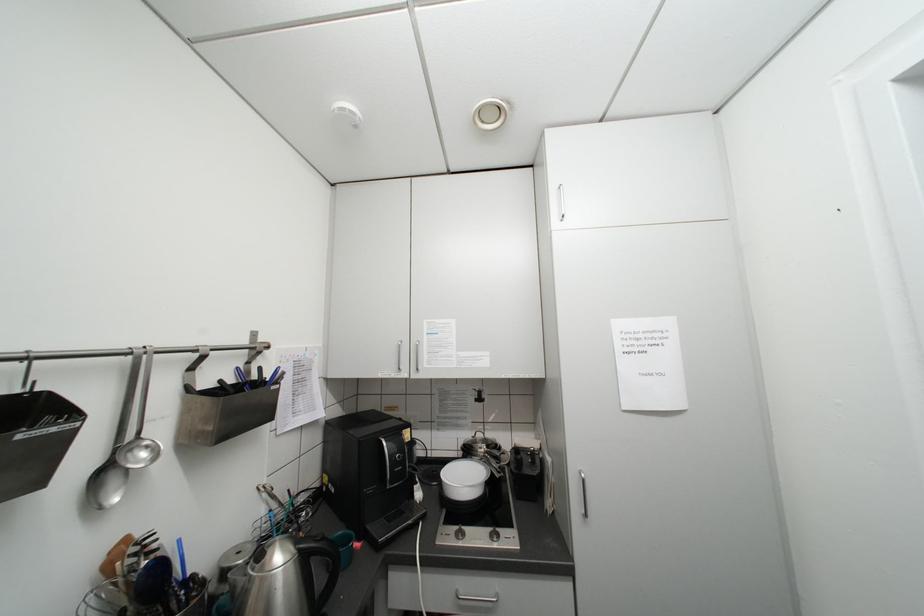
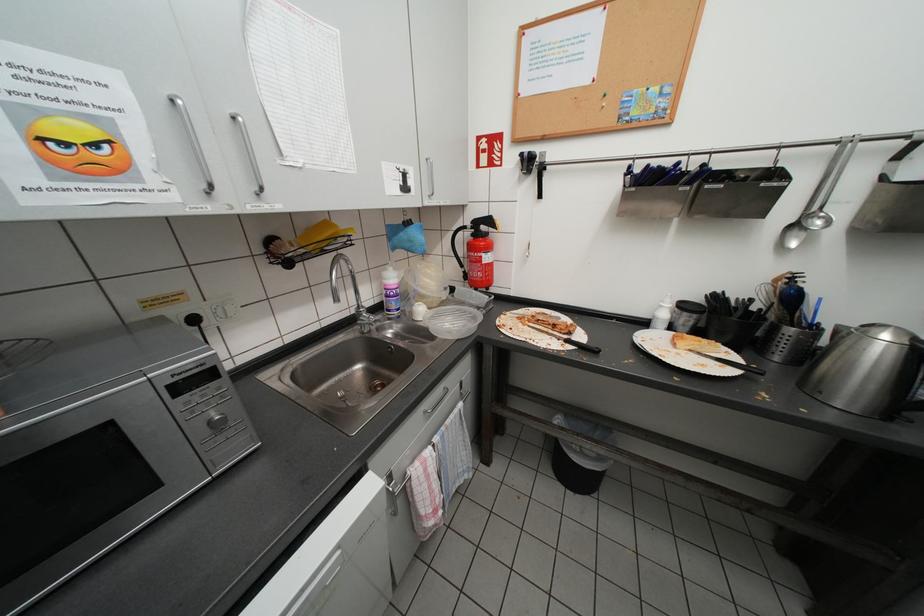
From the picture: The first image is from the beginning of the video and the second image is from the end. How did the camera likely rotate when shooting the video?

The camera's rotation is toward left-down.